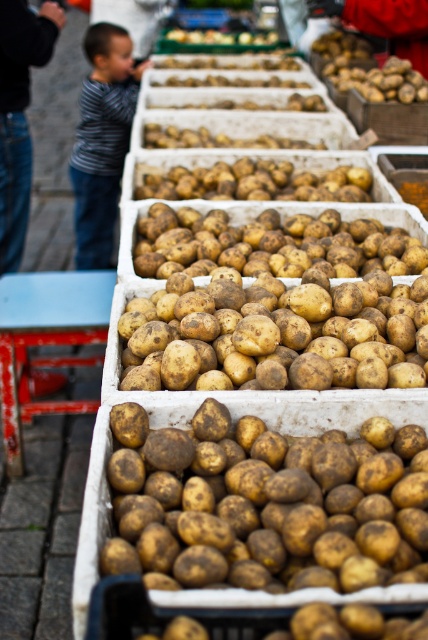
You are a customer at the market and want to choose a potato that is thinner. Which potato should you pick between the brown rough potato at center and the rustic brown potato at center?

The brown rough potato at center is thinner than the rustic brown potato at center, so you should pick the brown rough potato at center.

You are a customer at the market and want to buy a potato that is smaller in size. Which potato between the brown rough potato at center and the rustic brown potato at center should you choose?

The brown rough potato at center has a smaller size compared to rustic brown potato at center, so you should choose the brown rough potato at center.